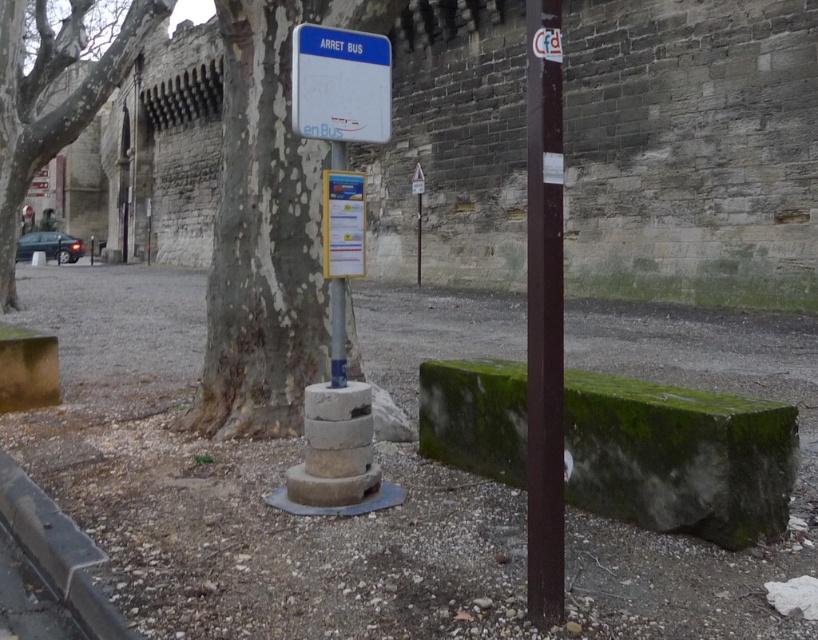
You are standing at the bus stop and want to lean against the nearest object. Which object should you choose between the brown polished wood pole at right and the smooth gray bark at left?

The brown polished wood pole at right is in front of smooth gray bark at left, so the nearest object is the brown polished wood pole at right. You should choose the brown polished wood pole at right.

You are a city planner examining this bus stop. You need to determine if the brown polished wood pole at right will block the visibility of the white plastic bus stop sign at center for pedestrians approaching from the front. Based on their positions, what do you conclude?

The brown polished wood pole at right is above the white plastic bus stop sign at center, so it will block the visibility of the white plastic bus stop sign at center for pedestrians approaching from the front.